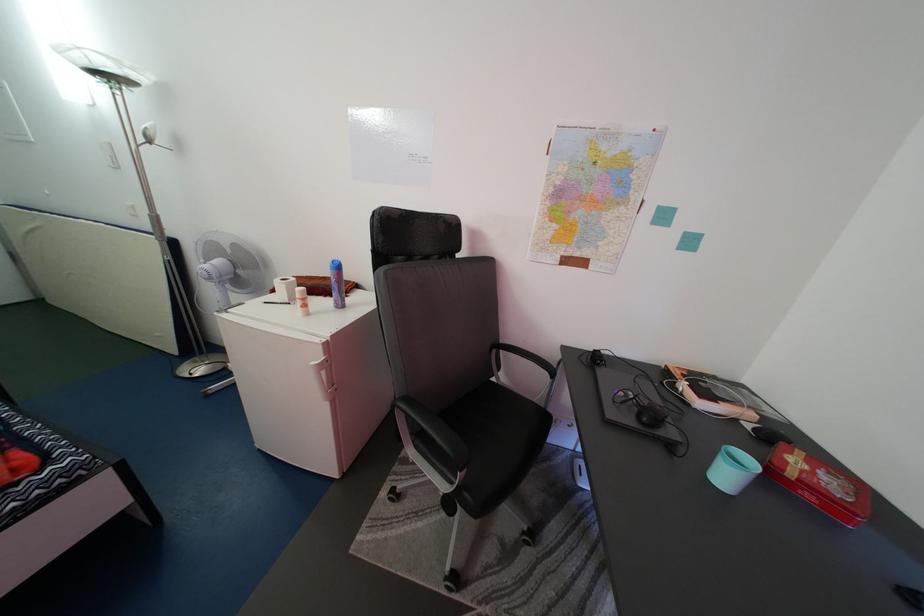
This screenshot has height=616, width=924. Describe the element at coordinates (525, 357) in the screenshot. I see `the black chair armrest` at that location.